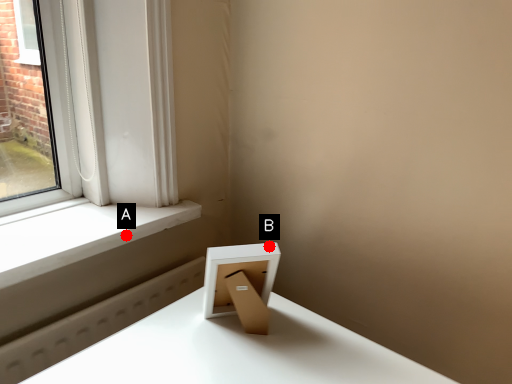
Question: Two points are circled on the image, labeled by A and B beside each circle. Which point is farther from the camera taking this photo?

Choices:
 (A) A is further
 (B) B is further

Answer: (A)